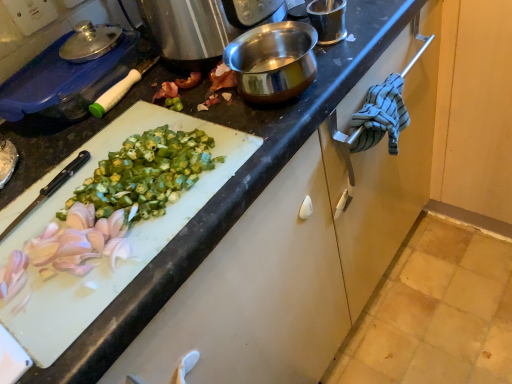
Question: Looking at the image, does blue striped cloth at right seem bigger or smaller compared to white glossy cutting board at center-left?

Choices:
 (A) small
 (B) big

Answer: (A)

Question: From a real-world perspective, relative to white glossy cutting board at center-left, is blue striped cloth at right vertically above or below?

Choices:
 (A) below
 (B) above

Answer: (A)

Question: Based on their relative distances, which object is nearer to the blue plastic container at upper left?

Choices:
 (A) blue striped cloth at right
 (B) white glossy cutting board at center-left

Answer: (B)

Question: Which object is positioned farthest from the blue plastic container at upper left?

Choices:
 (A) white glossy cutting board at center-left
 (B) blue striped cloth at right

Answer: (B)